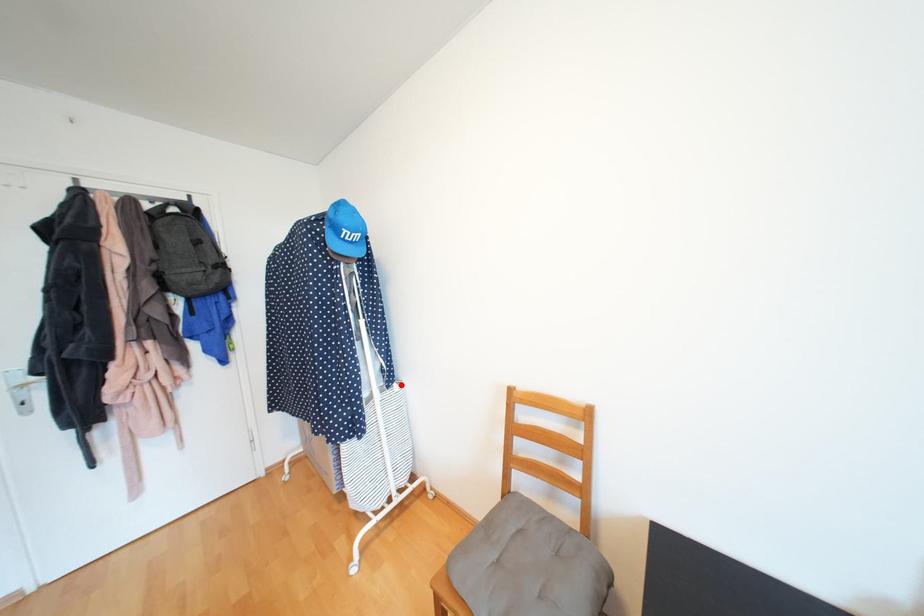
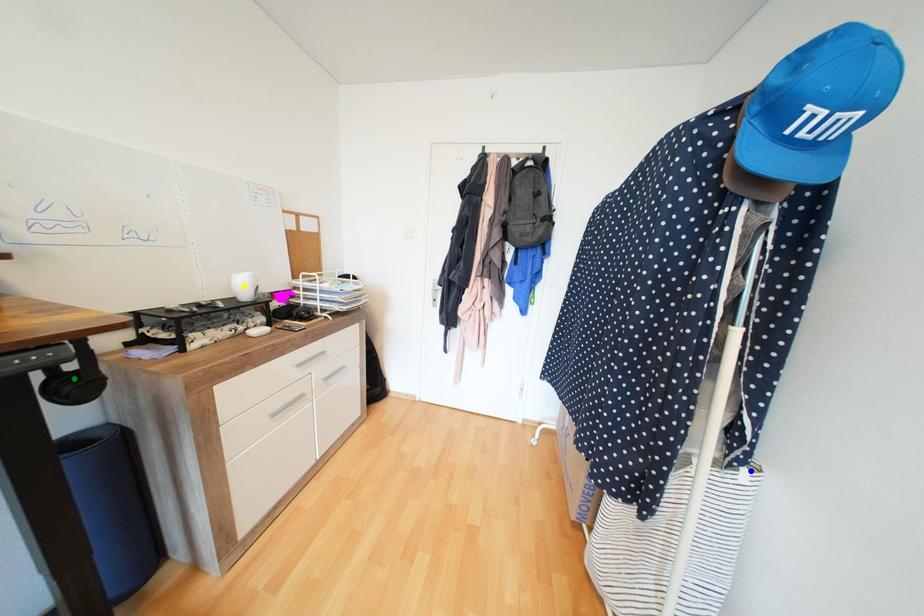
Question: I am providing you with two images of the same scene from different viewpoints. A red point is marked on the first image. You are given multiple points on the second image. Which spot in image 2 lines up with the point in image 1?

Choices:
 (A) green point
 (B) blue point
 (C) yellow point

Answer: (B)